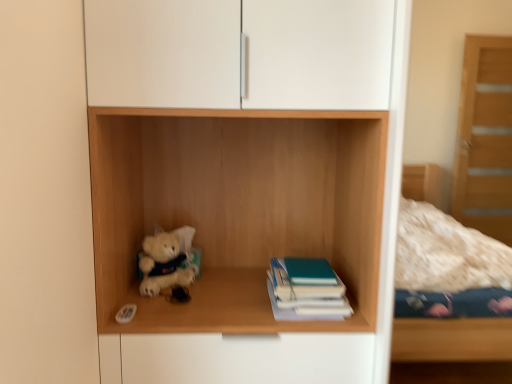
What are the coordinates of `free point to the right of fluffy white teddy bear at lower left` in the screenshot? It's located at (215, 292).